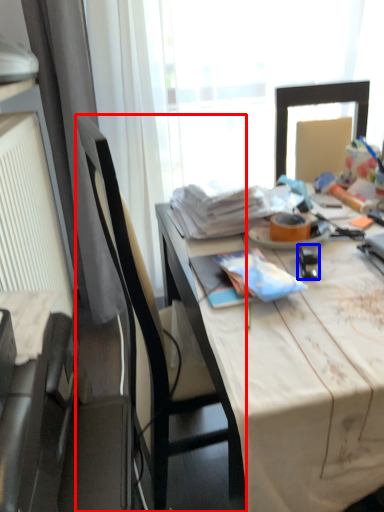
Question: Which of the following is the closest to the observer, chair (highlighted by a red box) or stationery (highlighted by a blue box)?

Choices:
 (A) chair
 (B) stationery

Answer: (A)